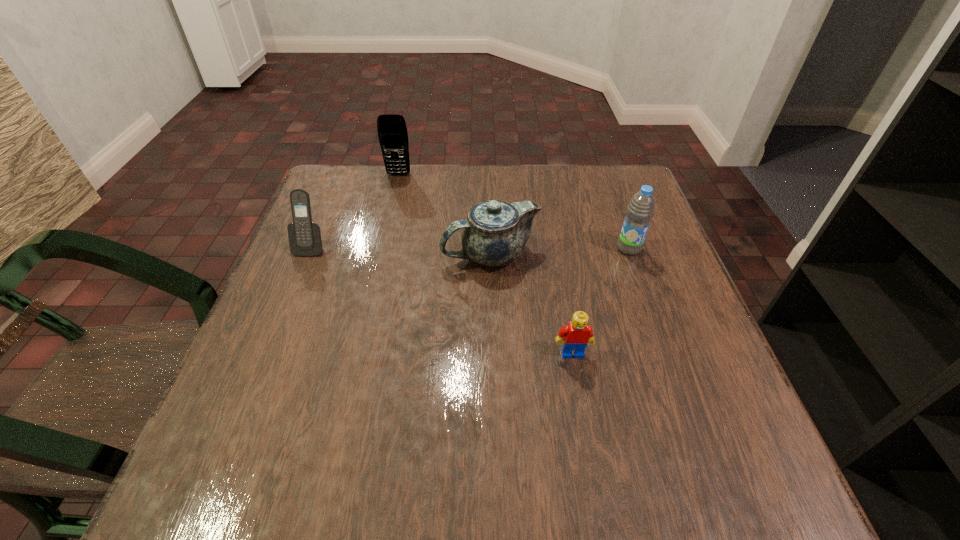
Where is `the farther cellular telephone`? This screenshot has width=960, height=540. the farther cellular telephone is located at coordinates (392, 132).

I want to click on the taller cellular telephone, so click(x=392, y=132).

Where is `water bottle`? water bottle is located at coordinates (641, 208).

Find the location of a particular element. The image size is (960, 540). chinaware is located at coordinates (494, 234).

Identify the location of the left cellular telephone. The height and width of the screenshot is (540, 960). pyautogui.click(x=305, y=239).

Locate an element on the screen. This screenshot has width=960, height=540. the shorter cellular telephone is located at coordinates (305, 239).

Locate an element on the screen. the second object from right to left is located at coordinates (575, 336).

What are the coordinates of `Lego` in the screenshot? It's located at 575,336.

Locate an element on the screen. Image resolution: width=960 pixels, height=540 pixels. vacant space situated 0.350m on the screen of the second object from left to right is located at coordinates (376, 267).

The image size is (960, 540). I want to click on vacant area situated on the left of the rightmost object, so click(x=461, y=248).